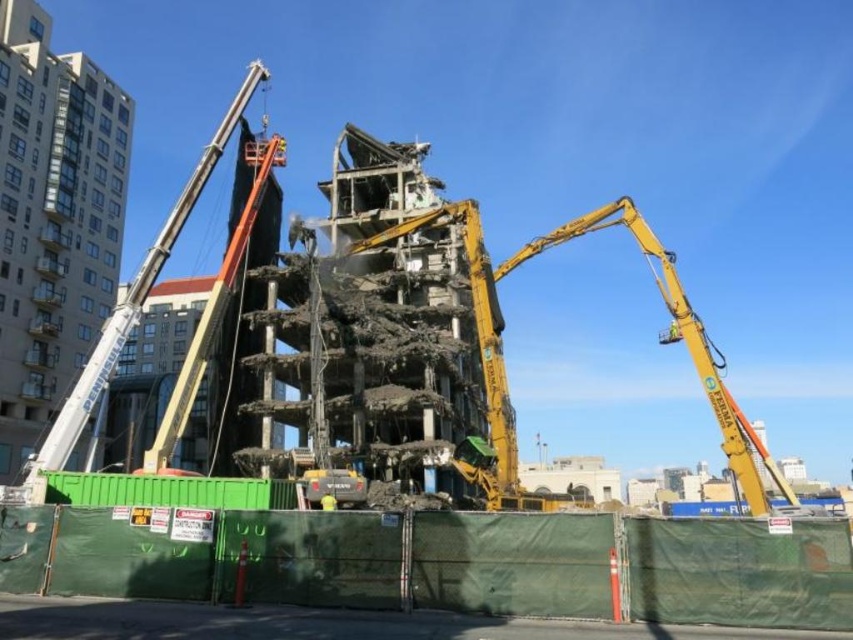
Between orange metallic crane at left and yellow fabric construction worker at center, which one has less height?

Standing shorter between the two is yellow fabric construction worker at center.

Between point (61, 452) and point (322, 499), which one is positioned behind?

The point (61, 452) is behind.

You are a GUI agent. You are given a task and a screenshot of the screen. Output one action in this format:
    pyautogui.click(x=<x>, y=<y>)
    Task: Click on the orange metallic crane at left
    
    Given the screenshot: What is the action you would take?
    pyautogui.click(x=126, y=310)

Does yellow metallic arm at center have a smaller size compared to yellow fabric construction worker at center?

Incorrect, yellow metallic arm at center is not smaller in size than yellow fabric construction worker at center.

Which is below, yellow metallic arm at center or yellow fabric construction worker at center?

yellow metallic arm at center is lower down.

Image resolution: width=853 pixels, height=640 pixels. I want to click on yellow metallic arm at center, so click(x=503, y=365).

Locate an element on the screen. The width and height of the screenshot is (853, 640). yellow metallic arm at center is located at coordinates (503, 365).

Between yellow metallic arm at center and orange metallic crane at left, which one has more height?

With more height is orange metallic crane at left.

Who is more forward, (497, 307) or (77, 436)?

Point (77, 436)

Locate an element on the screen. yellow metallic arm at center is located at coordinates (503, 365).